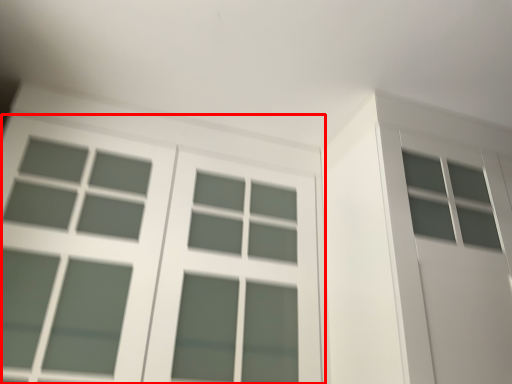
Question: Observing the image, what is the correct spatial positioning of window (annotated by the red box) in reference to screen door?

Choices:
 (A) right
 (B) left

Answer: (B)